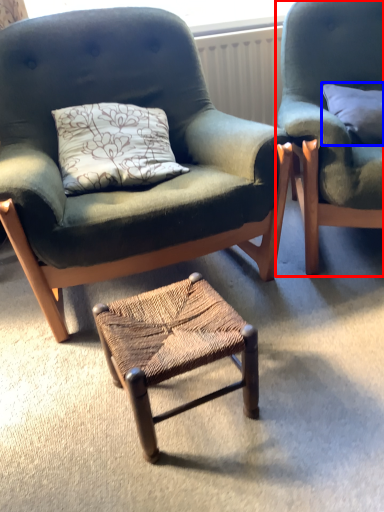
Question: Which object appears closest to the camera in this image, chair (highlighted by a red box) or pillow (highlighted by a blue box)?

Choices:
 (A) chair
 (B) pillow

Answer: (A)